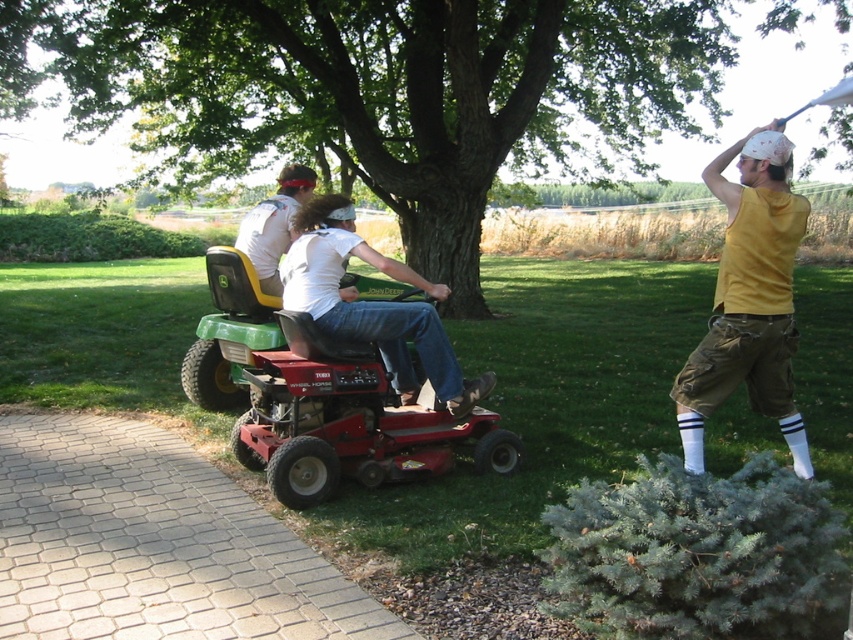
What is the object located at the coordinates point (318, 397) in the image?

The object located at point (318, 397) is the green plastic lawn mower at center.

You are a person standing next to the green plastic lawn mower at center. You want to hand a water bottle to the person wearing the matte white shirt at center. Can you reach them without moving the lawn mower or yourself?

The distance between the green plastic lawn mower at center and the matte white shirt at center is 1.28 meters. Since the average arm reach is about 1 meter, you cannot reach them without moving.